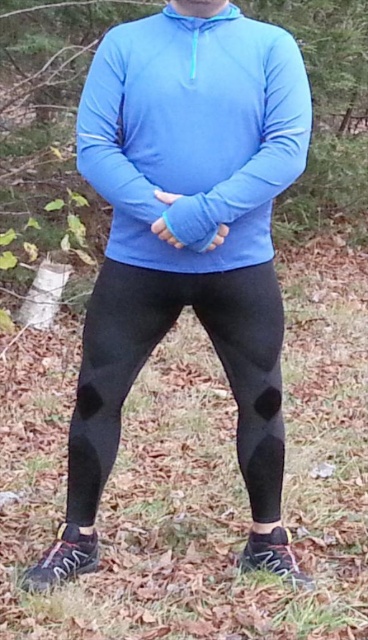
Question: Is the position of matte blue sweatshirt at center more distant than that of black mesh leggings at center?

Choices:
 (A) yes
 (B) no

Answer: (B)

Question: Does matte blue sweatshirt at center appear on the right side of black mesh leggings at center?

Choices:
 (A) no
 (B) yes

Answer: (B)

Question: Can you confirm if matte blue sweatshirt at center is thinner than black mesh leggings at center?

Choices:
 (A) yes
 (B) no

Answer: (A)

Question: Among these points, which one is nearest to the camera?

Choices:
 (A) (285, 102)
 (B) (238, 356)

Answer: (A)

Question: Which point appears farthest from the camera in this image?

Choices:
 (A) (238, 292)
 (B) (189, 232)

Answer: (A)